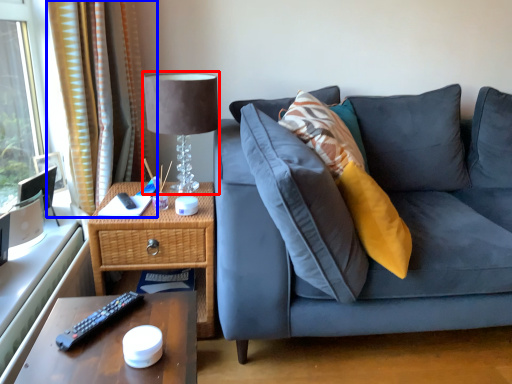
Question: Which object appears closest to the camera in this image, table lamp (highlighted by a red box) or curtain (highlighted by a blue box)?

Choices:
 (A) table lamp
 (B) curtain

Answer: (A)